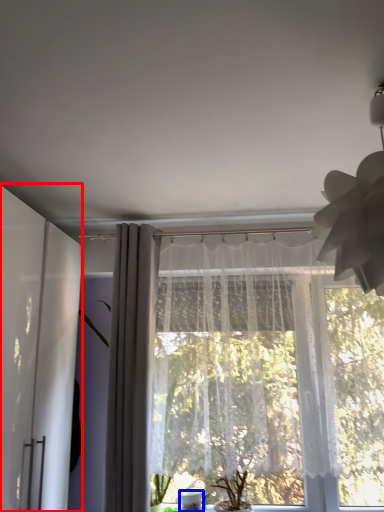
Question: Which object appears farthest to the camera in this image, screen door (highlighted by a red box) or glass vase (highlighted by a blue box)?

Choices:
 (A) screen door
 (B) glass vase

Answer: (B)